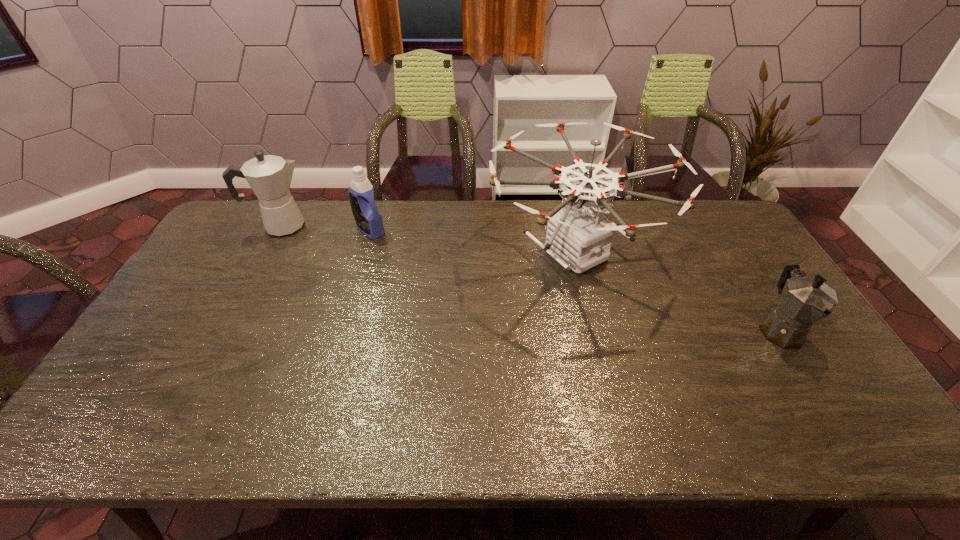
Identify the location of blank region between the detergent and the rightmost object. The height and width of the screenshot is (540, 960). coord(575,280).

This screenshot has height=540, width=960. Identify the location of free space between the third shortest object and the nearer coffeepot. coord(531,278).

Locate which object ranks second in proximity to the shorter coffeepot. Please provide its 2D coordinates. Your answer should be formatted as a tuple, i.e. [(x, y)], where the tuple contains the x and y coordinates of a point satisfying the conditions above.

[(368, 219)]

Select which object appears as the closest to the third object from left to right. Please provide its 2D coordinates. Your answer should be formatted as a tuple, i.e. [(x, y)], where the tuple contains the x and y coordinates of a point satisfying the conditions above.

[(804, 300)]

Identify the location of blank space that satisfies the following two spatial constraints: 1. on the front side of the leftmost object; 2. on the right side of the tallest object. (268, 252).

Where is `vacant space that satisfies the following two spatial constraints: 1. on the front side of the tallest object; 2. on the left side of the detergent`? vacant space that satisfies the following two spatial constraints: 1. on the front side of the tallest object; 2. on the left side of the detergent is located at coordinates (364, 252).